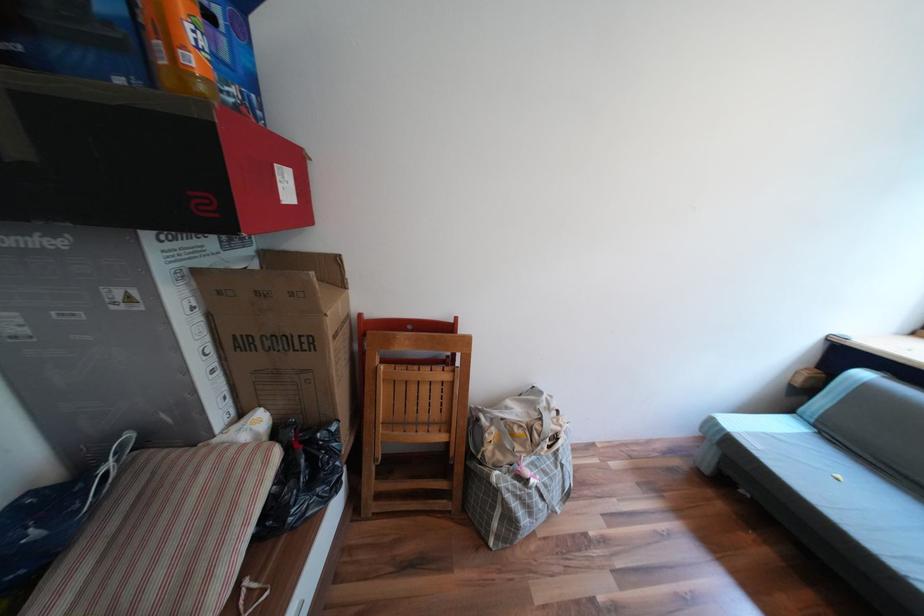
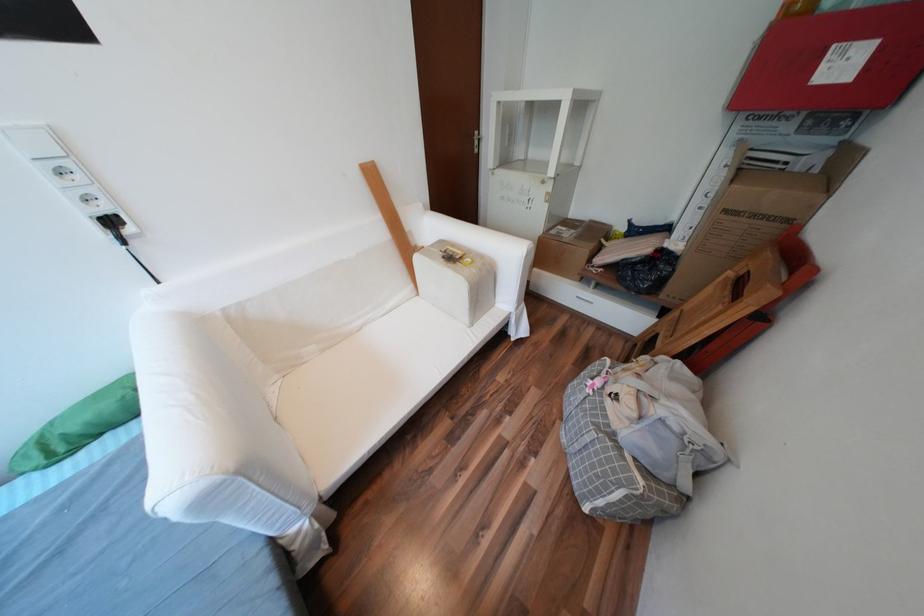
Where in the second image is the point corresponding to (344,337) from the first image?

(736, 211)